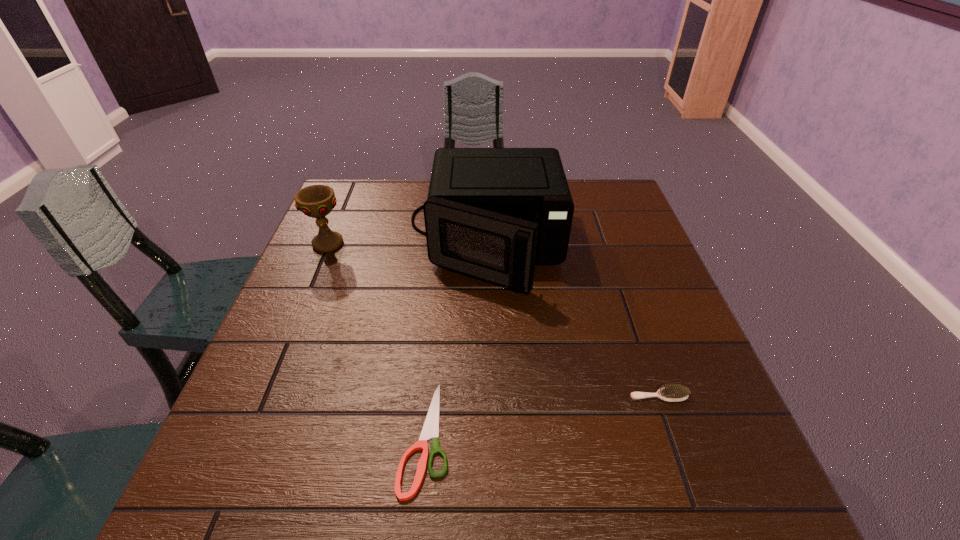
In the image, there is a desktop. Identify the location of vacant region at the near right corner. The width and height of the screenshot is (960, 540). (745, 483).

You are a GUI agent. You are given a task and a screenshot of the screen. Output one action in this format:
    pyautogui.click(x=<x>, y=<y>)
    Task: Click on the unoccupied position between the microwave oven and the third tallest object
    This screenshot has height=540, width=960.
    Given the screenshot: What is the action you would take?
    (573, 321)

The width and height of the screenshot is (960, 540). In order to click on free space between the second shortest object and the leftmost object in this screenshot , I will do `click(493, 319)`.

Locate an element on the screen. free space between the scissors and the microwave oven is located at coordinates (456, 341).

Image resolution: width=960 pixels, height=540 pixels. Find the location of `vacant point located between the second tallest object and the microwave oven`. vacant point located between the second tallest object and the microwave oven is located at coordinates (x=408, y=244).

I want to click on free space that is in between the microwave oven and the third tallest object, so click(x=573, y=321).

This screenshot has width=960, height=540. What are the coordinates of `unoccupied area between the scrubbing brush and the shortest object` in the screenshot? It's located at (542, 416).

You are a GUI agent. You are given a task and a screenshot of the screen. Output one action in this format:
    pyautogui.click(x=<x>, y=<y>)
    Task: Click on the vacant area that lies between the shortest object and the second shortest object
    This screenshot has width=960, height=540.
    Given the screenshot: What is the action you would take?
    pyautogui.click(x=542, y=416)

This screenshot has width=960, height=540. Identify the location of empty space that is in between the leftmost object and the scissors. (377, 340).

I want to click on vacant point located between the scissors and the microwave oven, so click(456, 341).